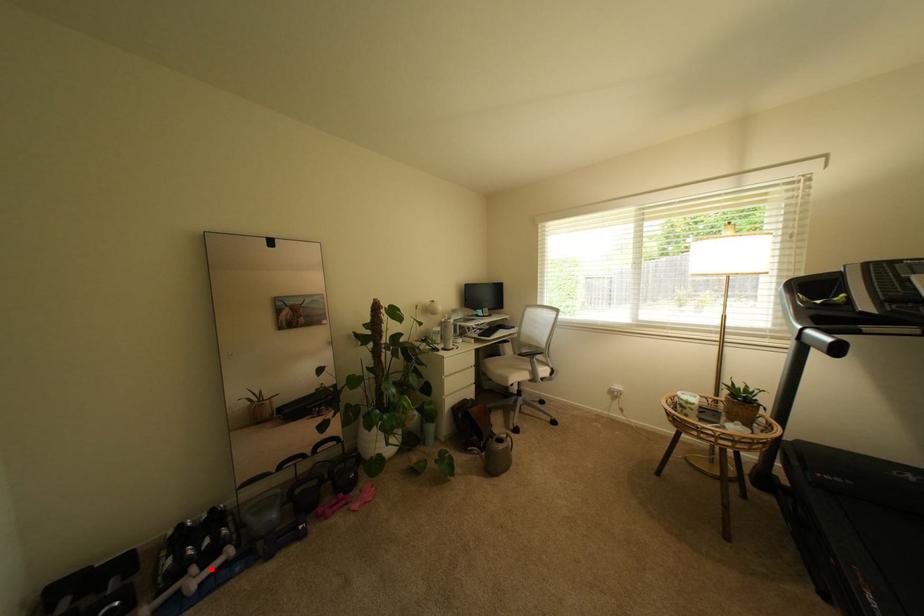
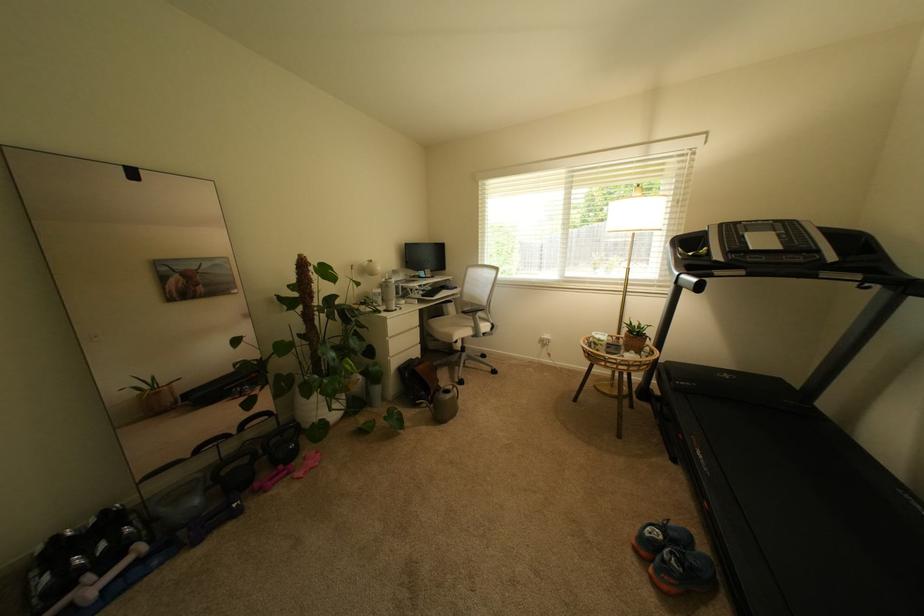
Question: A red point is marked in image1. In image2, is the corresponding 3D point closer to the camera or farther? Reply with the corresponding letter.

Choices:
 (A) The corresponding 3D point is closer.
 (B) The corresponding 3D point is farther.

Answer: (A)